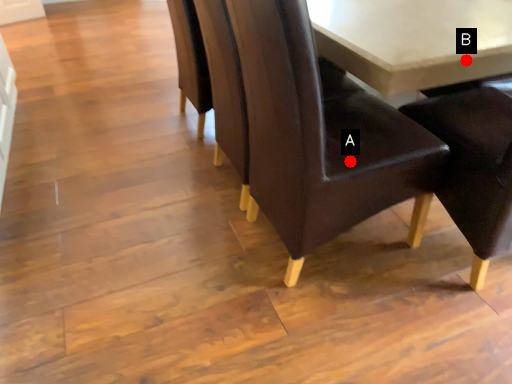
Question: Two points are circled on the image, labeled by A and B beside each circle. Which point appears closest to the camera in this image?

Choices:
 (A) A is closer
 (B) B is closer

Answer: (B)